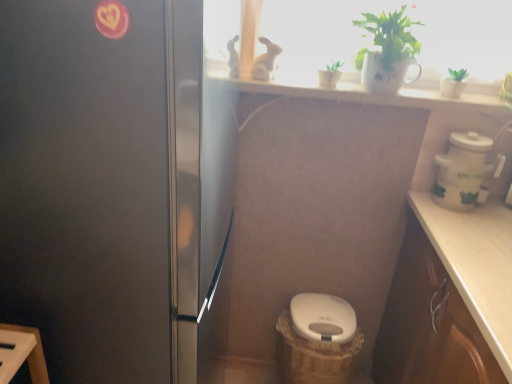
Find the location of a particular element. white ceramic pot at right is located at coordinates (461, 171).

The width and height of the screenshot is (512, 384). Find the location of `green matte plant at upper right, positioned as the first houseplant in right-to-left order`. green matte plant at upper right, positioned as the first houseplant in right-to-left order is located at coordinates (453, 83).

The width and height of the screenshot is (512, 384). What do you see at coordinates (322, 317) in the screenshot?
I see `white glossy toilet bowl at center` at bounding box center [322, 317].

This screenshot has height=384, width=512. Describe the element at coordinates (387, 51) in the screenshot. I see `white ceramic mug at upper center, which ranks as the second houseplant in left-to-right order` at that location.

Where is `white ceramic pot at right`? Image resolution: width=512 pixels, height=384 pixels. white ceramic pot at right is located at coordinates (461, 171).

Is satin black fridge at left inside or outside of white glossy toilet bowl at center?

satin black fridge at left is spatially situated outside white glossy toilet bowl at center.

Which object is more forward, satin black fridge at left or white glossy toilet bowl at center?

Positioned in front is satin black fridge at left.

Considering the relative positions of satin black fridge at left and white glossy toilet bowl at center in the image provided, is satin black fridge at left to the right of white glossy toilet bowl at center from the viewer's perspective?

No, satin black fridge at left is not to the right of white glossy toilet bowl at center.

Does point (204, 311) come farther from viewer compared to point (340, 310)?

That is False.

In terms of height, does white ceramic pot at right look taller or shorter compared to green matte plant at upper center, the third houseplant in the right-to-left sequence?

Clearly, white ceramic pot at right is taller compared to green matte plant at upper center, the third houseplant in the right-to-left sequence.

Is white ceramic pot at right far from green matte plant at upper center, the third houseplant in the right-to-left sequence?

white ceramic pot at right is near green matte plant at upper center, the third houseplant in the right-to-left sequence, not far away.

Does white ceramic pot at right have a greater width compared to green matte plant at upper center, acting as the first houseplant starting from the left?

Yes.

From a real-world perspective, who is located lower, white ceramic mug at upper center, which ranks as the second houseplant in left-to-right order, or white glossy toilet bowl at center?

white glossy toilet bowl at center, from a real-world perspective.

How distant is white ceramic mug at upper center, marked as the 2th houseplant in a right-to-left arrangement, from white glossy toilet bowl at center?

They are 31.38 inches apart.

Considering the sizes of objects white ceramic mug at upper center, which ranks as the second houseplant in left-to-right order, and white glossy toilet bowl at center in the image provided, who is bigger, white ceramic mug at upper center, which ranks as the second houseplant in left-to-right order, or white glossy toilet bowl at center?

white ceramic mug at upper center, which ranks as the second houseplant in left-to-right order.

Does white ceramic mug at upper center, which ranks as the second houseplant in left-to-right order, have a greater width compared to white glossy toilet bowl at center?

In fact, white ceramic mug at upper center, which ranks as the second houseplant in left-to-right order, might be narrower than white glossy toilet bowl at center.

From a real-world perspective, is white ceramic mug at upper center, which ranks as the second houseplant in left-to-right order, above or below green matte plant at upper center, the third houseplant in the right-to-left sequence?

In terms of real-world spatial position, white ceramic mug at upper center, which ranks as the second houseplant in left-to-right order, is above green matte plant at upper center, the third houseplant in the right-to-left sequence.

In the scene shown: Are white ceramic mug at upper center, marked as the 2th houseplant in a right-to-left arrangement, and green matte plant at upper center, acting as the first houseplant starting from the left, located far from each other?

No, white ceramic mug at upper center, marked as the 2th houseplant in a right-to-left arrangement, is not far from green matte plant at upper center, acting as the first houseplant starting from the left.

Does white ceramic mug at upper center, marked as the 2th houseplant in a right-to-left arrangement, have a greater width compared to green matte plant at upper center, acting as the first houseplant starting from the left?

Indeed, white ceramic mug at upper center, marked as the 2th houseplant in a right-to-left arrangement, has a greater width compared to green matte plant at upper center, acting as the first houseplant starting from the left.

Which is correct: green matte plant at upper center, the third houseplant in the right-to-left sequence, is inside satin black fridge at left, or outside of it?

green matte plant at upper center, the third houseplant in the right-to-left sequence, is outside satin black fridge at left.

Is green matte plant at upper center, acting as the first houseplant starting from the left, facing towards satin black fridge at left?

No, green matte plant at upper center, acting as the first houseplant starting from the left, is not aimed at satin black fridge at left.

Is the surface of green matte plant at upper center, acting as the first houseplant starting from the left, in direct contact with satin black fridge at left?

No, green matte plant at upper center, acting as the first houseplant starting from the left, is not in contact with satin black fridge at left.

Is green matte plant at upper center, acting as the first houseplant starting from the left, shorter than satin black fridge at left?

Yes, green matte plant at upper center, acting as the first houseplant starting from the left, is shorter than satin black fridge at left.

In the image, is white glossy toilet bowl at center positioned in front of or behind white ceramic window sill at upper center?

white glossy toilet bowl at center is positioned farther from the viewer than white ceramic window sill at upper center.

From the image's perspective, between white glossy toilet bowl at center and white ceramic window sill at upper center, who is located below?

white glossy toilet bowl at center, from the image's perspective.

Consider the image. Is white glossy toilet bowl at center completely or partially outside of white ceramic window sill at upper center?

white glossy toilet bowl at center lies outside white ceramic window sill at upper center's area.

Is white glossy toilet bowl at center with white ceramic window sill at upper center?

There is a gap between white glossy toilet bowl at center and white ceramic window sill at upper center.

Is brown woven basket at lower center situated inside green matte plant at upper center, the third houseplant in the right-to-left sequence, or outside?

The correct answer is: outside.

Is brown woven basket at lower center far away from green matte plant at upper center, the third houseplant in the right-to-left sequence?

No, brown woven basket at lower center is in close proximity to green matte plant at upper center, the third houseplant in the right-to-left sequence.

Is brown woven basket at lower center wider than green matte plant at upper center, the third houseplant in the right-to-left sequence?

Yes.

Considering the sizes of objects brown woven basket at lower center and green matte plant at upper center, the third houseplant in the right-to-left sequence, in the image provided, who is smaller, brown woven basket at lower center or green matte plant at upper center, the third houseplant in the right-to-left sequence,?

green matte plant at upper center, the third houseplant in the right-to-left sequence.

The height and width of the screenshot is (384, 512). Find the location of `toilet bowl on the right of satin black fridge at left`. toilet bowl on the right of satin black fridge at left is located at coordinates (322, 317).

The image size is (512, 384). Identify the location of appliance below the green matte plant at upper center, acting as the first houseplant starting from the left (from a real-world perspective). (461, 171).

Looking at the image, which one is located further to satin black fridge at left, green matte plant at upper center, acting as the first houseplant starting from the left, or brown woven basket at lower center?

brown woven basket at lower center is further to satin black fridge at left.

Based on the photo, based on their spatial positions, is green matte plant at upper center, acting as the first houseplant starting from the left, or green matte plant at upper right, which is the third houseplant in left-to-right order, further from white ceramic pot at right?

The object further to white ceramic pot at right is green matte plant at upper center, acting as the first houseplant starting from the left.

When comparing their distances from white ceramic pot at right, does white ceramic mug at upper center, which ranks as the second houseplant in left-to-right order, or white glossy toilet bowl at center seem further?

The object further to white ceramic pot at right is white glossy toilet bowl at center.

When comparing their distances from satin black fridge at left, does white ceramic window sill at upper center or white ceramic mug at upper center, which ranks as the second houseplant in left-to-right order, seem further?

white ceramic mug at upper center, which ranks as the second houseplant in left-to-right order, is positioned further to the anchor satin black fridge at left.

Considering their positions, is green matte plant at upper right, positioned as the first houseplant in right-to-left order, positioned closer to white ceramic window sill at upper center than white ceramic mug at upper center, which ranks as the second houseplant in left-to-right order?

The object closer to white ceramic window sill at upper center is white ceramic mug at upper center, which ranks as the second houseplant in left-to-right order.

Consider the image. Estimate the real-world distances between objects in this image. Which object is closer to white ceramic mug at upper center, which ranks as the second houseplant in left-to-right order, brown woven basket at lower center or white ceramic window sill at upper center?

white ceramic window sill at upper center is positioned closer to the anchor white ceramic mug at upper center, which ranks as the second houseplant in left-to-right order.

When comparing their distances from white ceramic window sill at upper center, does satin black fridge at left or green matte plant at upper center, acting as the first houseplant starting from the left, seem further?

satin black fridge at left.

Estimate the real-world distances between objects in this image. Which object is further from white glossy toilet bowl at center, green matte plant at upper center, the third houseplant in the right-to-left sequence, or green matte plant at upper right, which is the third houseplant in left-to-right order?

green matte plant at upper right, which is the third houseplant in left-to-right order, is further to white glossy toilet bowl at center.

This screenshot has width=512, height=384. I want to click on window sill situated between satin black fridge at left and green matte plant at upper right, positioned as the first houseplant in right-to-left order, from left to right, so click(x=354, y=92).

Find the location of a particular element. This screenshot has height=384, width=512. window sill between satin black fridge at left and white ceramic mug at upper center, marked as the 2th houseplant in a right-to-left arrangement is located at coordinates (354, 92).

Identify the location of appliance between white ceramic mug at upper center, marked as the 2th houseplant in a right-to-left arrangement, and white glossy toilet bowl at center from top to bottom. The width and height of the screenshot is (512, 384). (461, 171).

Identify the location of basket container between satin black fridge at left and white ceramic pot at right from left to right. (315, 356).